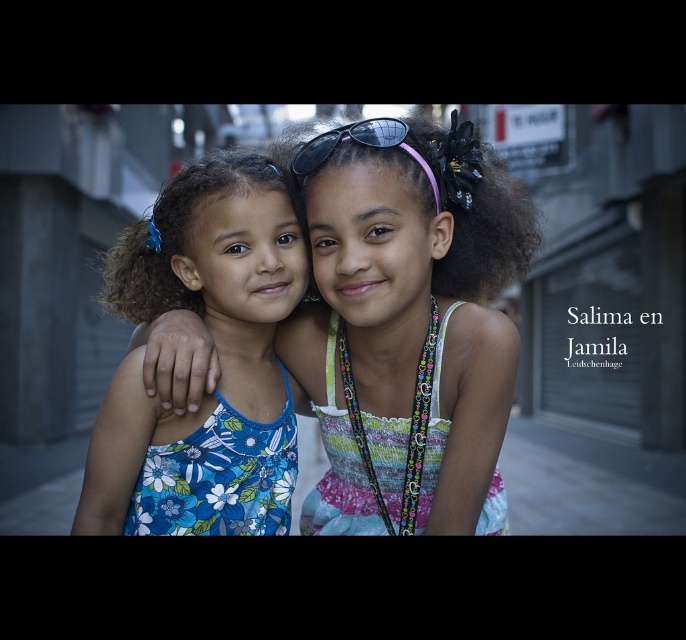
Which is behind, point (292, 234) or point (421, 160)?

Point (292, 234)

Does point (272, 474) come closer to viewer compared to point (300, 161)?

No, it is not.

Locate an element on the screen. The height and width of the screenshot is (640, 686). blue floral dress at left is located at coordinates (220, 353).

Is floral fabric dress at center smaller than sunglasses at center?

Actually, floral fabric dress at center might be larger than sunglasses at center.

Can you confirm if floral fabric dress at center is thinner than sunglasses at center?

In fact, floral fabric dress at center might be wider than sunglasses at center.

At what (x,y) coordinates should I click in order to perform the action: click on floral fabric dress at center. Please return your answer as a coordinate pair (x, y). The width and height of the screenshot is (686, 640). Looking at the image, I should click on (405, 323).

Where is `floral fabric dress at center`? floral fabric dress at center is located at coordinates (405, 323).

Is point (370, 305) closer to camera compared to point (263, 442)?

Yes, it is.

The width and height of the screenshot is (686, 640). I want to click on floral fabric dress at center, so click(x=405, y=323).